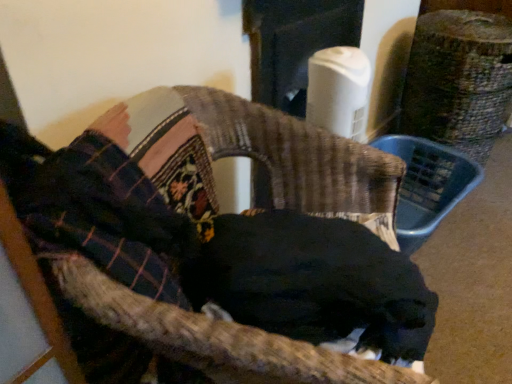
Question: Is the depth of woven fabric chair at center greater than that of plaid fabric at upper left?

Choices:
 (A) yes
 (B) no

Answer: (B)

Question: Considering the relative sizes of woven fabric chair at center and plaid fabric at upper left in the image provided, is woven fabric chair at center bigger than plaid fabric at upper left?

Choices:
 (A) no
 (B) yes

Answer: (B)

Question: Could you tell me if woven fabric chair at center is turned towards plaid fabric at upper left?

Choices:
 (A) no
 (B) yes

Answer: (A)

Question: Does woven fabric chair at center have a lesser height compared to plaid fabric at upper left?

Choices:
 (A) no
 (B) yes

Answer: (A)

Question: Is plaid fabric at upper left inside woven fabric chair at center?

Choices:
 (A) no
 (B) yes

Answer: (B)

Question: Is woven fabric chair at center at the left side of plaid fabric at upper left?

Choices:
 (A) yes
 (B) no

Answer: (B)

Question: Considering the relative sizes of black fur dog at center and woven fabric chair at center in the image provided, is black fur dog at center shorter than woven fabric chair at center?

Choices:
 (A) yes
 (B) no

Answer: (A)

Question: Is black fur dog at center positioned before woven fabric chair at center?

Choices:
 (A) yes
 (B) no

Answer: (B)

Question: Is black fur dog at center beside woven fabric chair at center?

Choices:
 (A) yes
 (B) no

Answer: (A)

Question: Considering the relative sizes of black fur dog at center and woven fabric chair at center in the image provided, is black fur dog at center bigger than woven fabric chair at center?

Choices:
 (A) yes
 (B) no

Answer: (B)

Question: Is black fur dog at center not within woven fabric chair at center?

Choices:
 (A) no
 (B) yes

Answer: (A)

Question: Is black fur dog at center positioned behind woven fabric chair at center?

Choices:
 (A) yes
 (B) no

Answer: (A)

Question: Considering the relative sizes of woven fabric chair at center and black fur dog at center in the image provided, is woven fabric chair at center thinner than black fur dog at center?

Choices:
 (A) no
 (B) yes

Answer: (A)